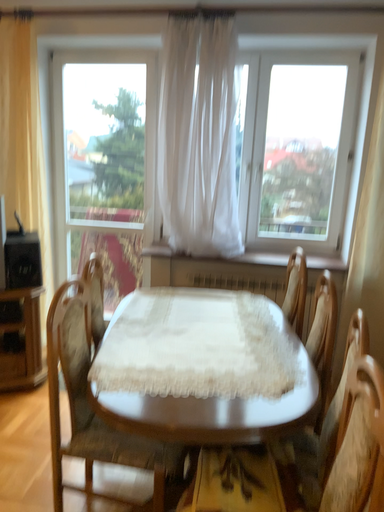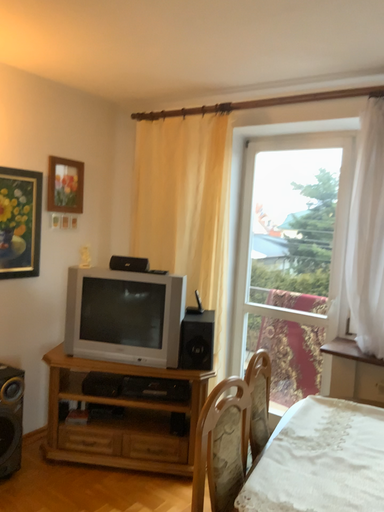
Question: How did the camera likely rotate when shooting the video?

Choices:
 (A) rotated upward
 (B) rotated downward

Answer: (A)